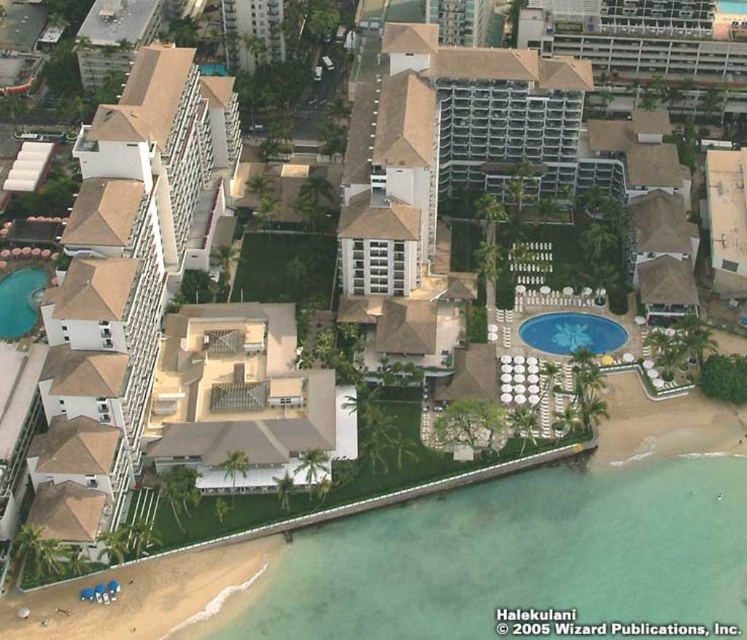
You are planning to take a drone photo of the Halekulani resort from above. The drone must capture the blue glossy pool at center right. According to the coordinates provided, where should the drone focus its camera to ensure the pool is centered in the frame?

The blue glossy pool at center right is located at point (571, 332), so the drone should focus its camera at those coordinates to center the pool in the frame.

You are standing at the center of the Halekulani resort pool area. You see two points marked on the ground, point (557, 340) and point (16, 305). Which point is closer to you?

Point (557, 340) is closer to the viewer than point (16, 305), so the point closer to you is point (557, 340).

You are a guest at the Halekulani resort and want to find the blue glossy pool at center right. From the teal glossy pool at bottom left, in which direction should you go?

The blue glossy pool at center right is to the right of the teal glossy pool at bottom left, so you should go to the right direction from the teal glossy pool at bottom left to reach the blue glossy pool at center right.